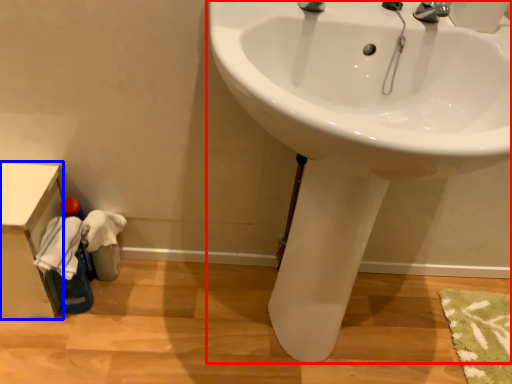
Question: Which of the following is the closest to the observer, sink (highlighted by a red box) or counter top (highlighted by a blue box)?

Choices:
 (A) sink
 (B) counter top

Answer: (A)